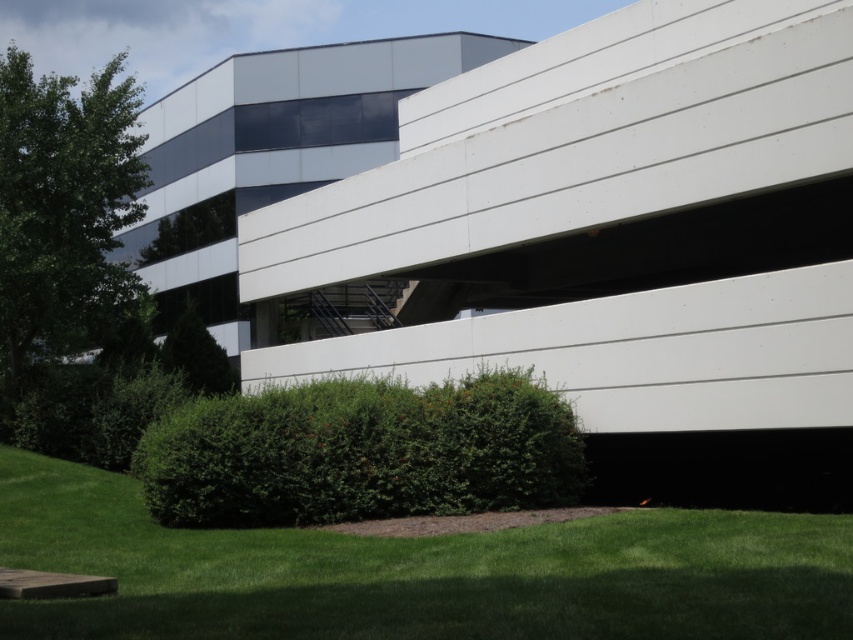
Based on the photo, you are standing at the point marked by the coordinates point (361,452). Looking towards the modern building with white panels and dark blue glass windows, can you tell me what you see directly in front of you?

The point (361,452) marks the green leafy bush at lower center, so directly in front of you is the green leafy bush at lower center.

You are a landscape architect evaluating the building site. You need to determine which of the two plants, the green leafy bush at lower center or the green leafy tree at left, requires more frequent pruning to maintain their current sizes. Based on their sizes, which one would you prioritize?

The green leafy bush at lower center is not as tall as the green leafy tree at left, so it likely requires more frequent pruning to maintain its smaller size.